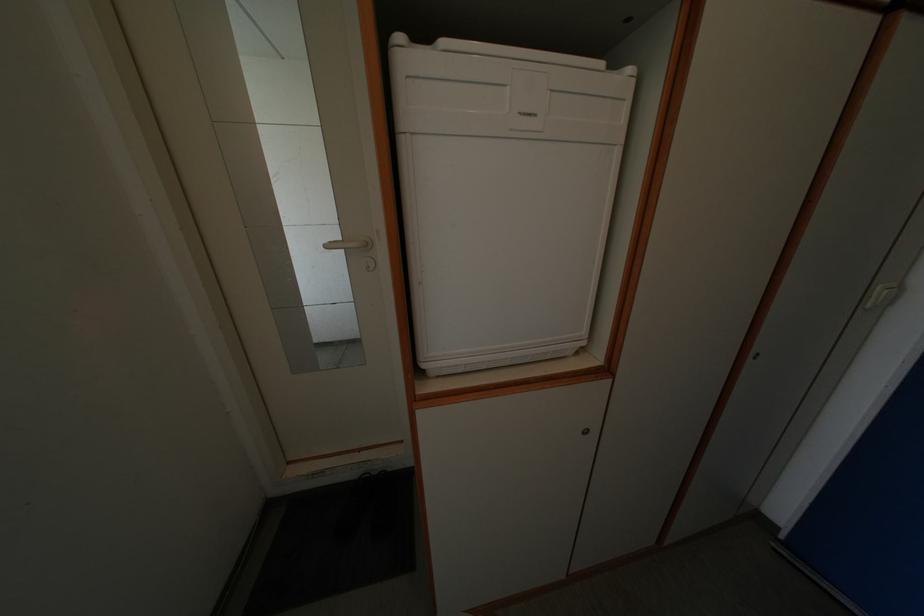
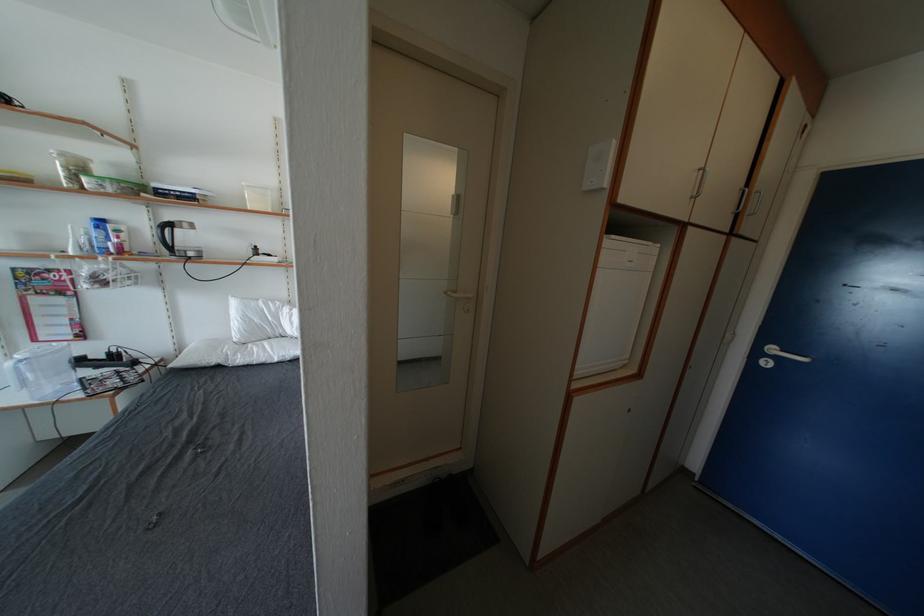
Question: The camera is either moving clockwise (left) or counter-clockwise (right) around the object. The first image is from the beginning of the video and the second image is from the end. Is the camera moving left or right when shooting the video?

Choices:
 (A) Left
 (B) Right

Answer: (A)